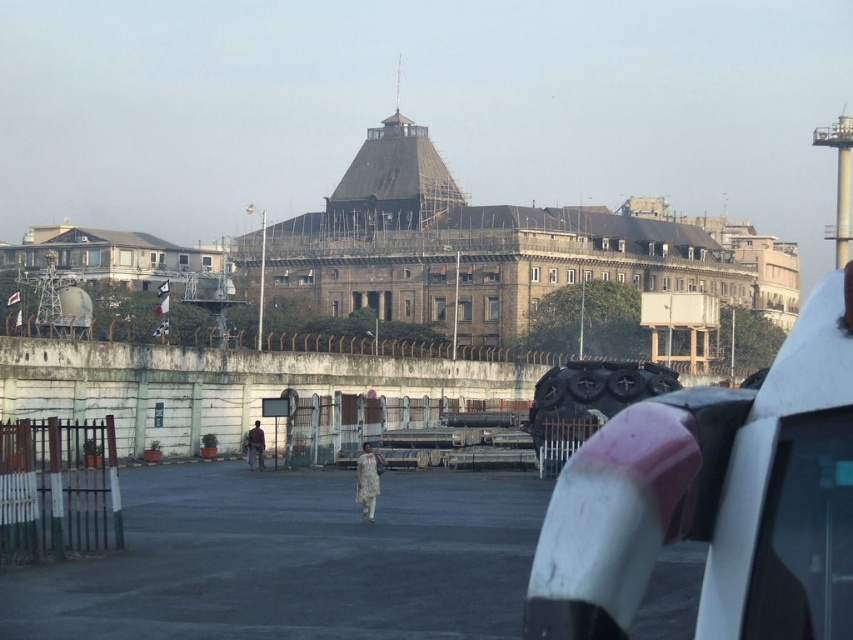
You are a pedestrian standing on the paved area in front of the brown stone building at upper left and the light brown fabric dress at center. Which object is wider?

The brown stone building at upper left might be wider than the light brown fabric dress at center according to the description.

Looking at this image, you are standing at the origin point of the image coordinate system. The image coordinate system has its origin at the bottom left corner. You need to locate the brown stone building at upper left. What are its coordinates?

The coordinates of the brown stone building at upper left are at point [111,256].